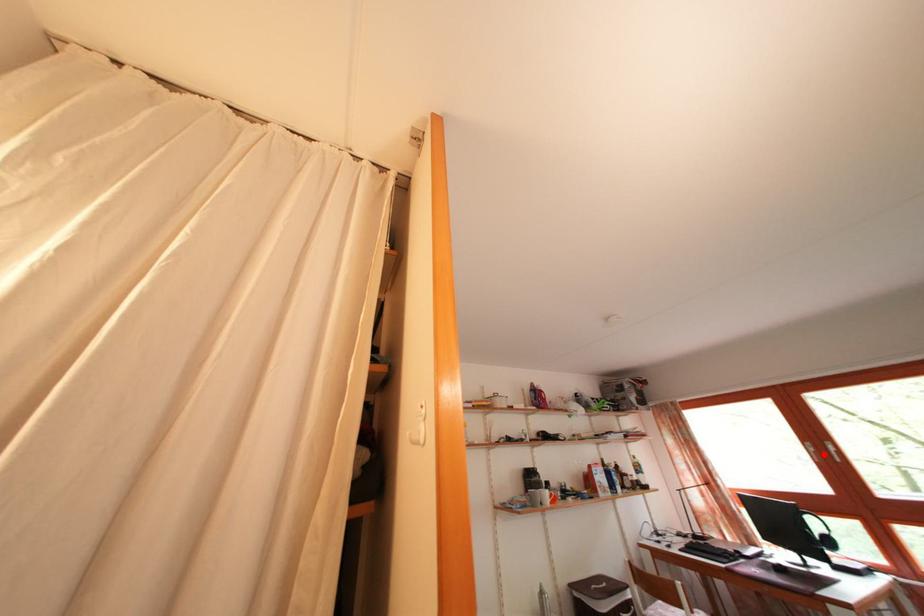
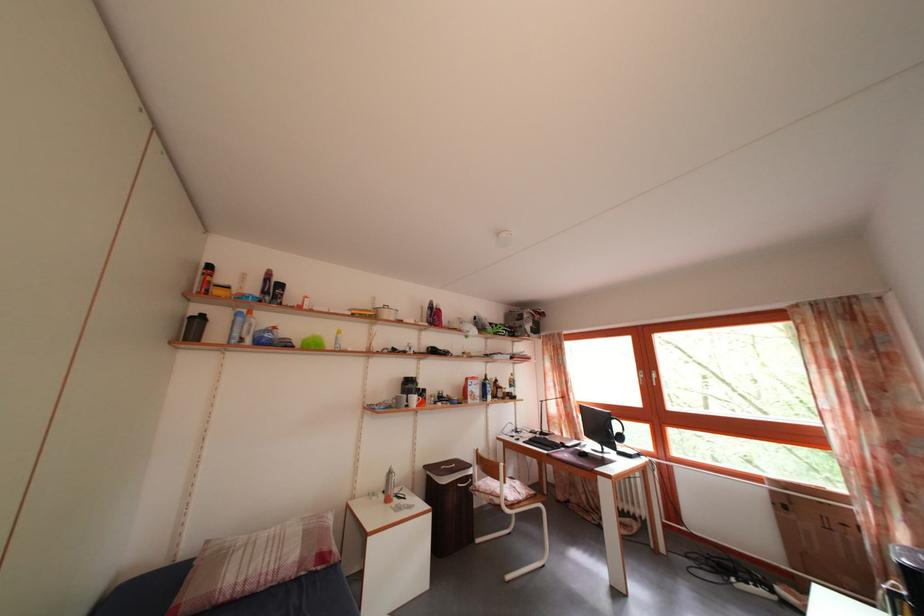
The point at the highlighted location is marked in the first image. Where is the corresponding point in the second image?

(652, 382)